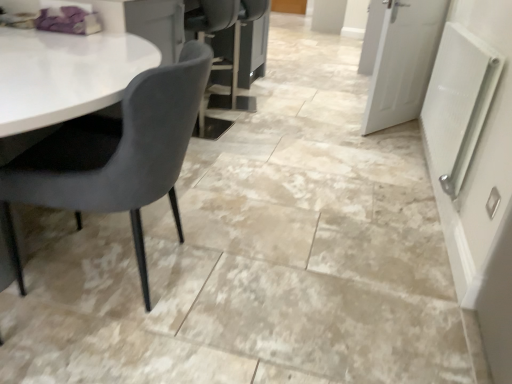
At what (x,y) coordinates should I click in order to perform the action: click on unoccupied space behind velvet grey chair at left. Please return your answer as a coordinate pair (x, y). The image size is (512, 384). Looking at the image, I should click on point(196,205).